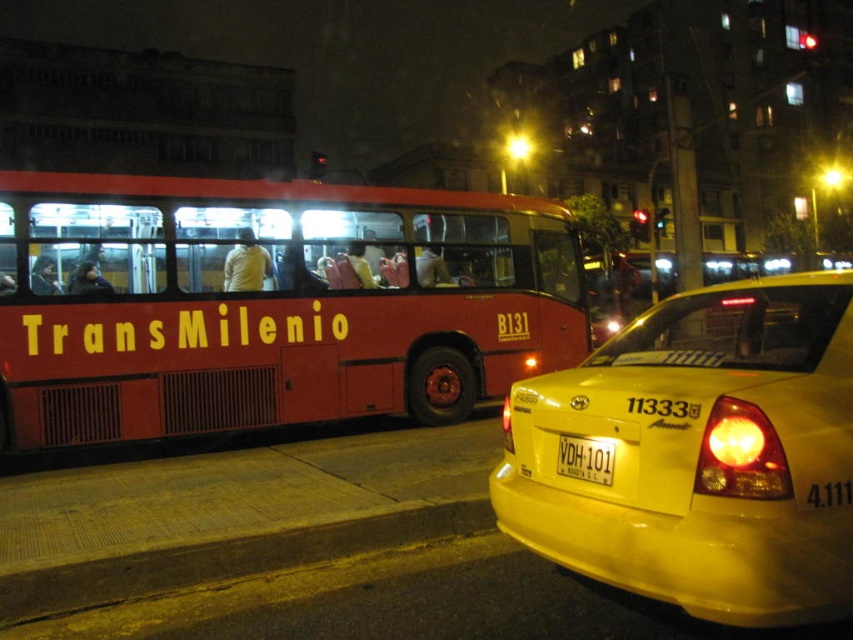
Can you confirm if red matte transmilenio bus at left is positioned above yellow plastic license plate at center?

Correct, red matte transmilenio bus at left is located above yellow plastic license plate at center.

Is red matte transmilenio bus at left wider than yellow plastic license plate at center?

Yes, red matte transmilenio bus at left is wider than yellow plastic license plate at center.

At what (x,y) coordinates should I click in order to perform the action: click on red matte transmilenio bus at left. Please return your answer as a coordinate pair (x, y). Looking at the image, I should click on (270, 304).

Where is `red matte transmilenio bus at left`? Image resolution: width=853 pixels, height=640 pixels. red matte transmilenio bus at left is located at coordinates (270, 304).

Is red matte transmilenio bus at left closer to the viewer compared to yellow asphalt curb at lower left?

No, it is behind yellow asphalt curb at lower left.

Can you confirm if red matte transmilenio bus at left is bigger than yellow asphalt curb at lower left?

Yes, red matte transmilenio bus at left is bigger than yellow asphalt curb at lower left.

Image resolution: width=853 pixels, height=640 pixels. What are the coordinates of `red matte transmilenio bus at left` in the screenshot? It's located at (270, 304).

Is yellow matte taxi at lower right below yellow asphalt curb at lower left?

Actually, yellow matte taxi at lower right is above yellow asphalt curb at lower left.

Does yellow matte taxi at lower right appear on the right side of yellow asphalt curb at lower left?

Yes, yellow matte taxi at lower right is to the right of yellow asphalt curb at lower left.

Which is behind, point (828, 433) or point (49, 577)?

The point (49, 577) is behind.

Find the location of `yellow matte taxi at lower right`. yellow matte taxi at lower right is located at coordinates (701, 452).